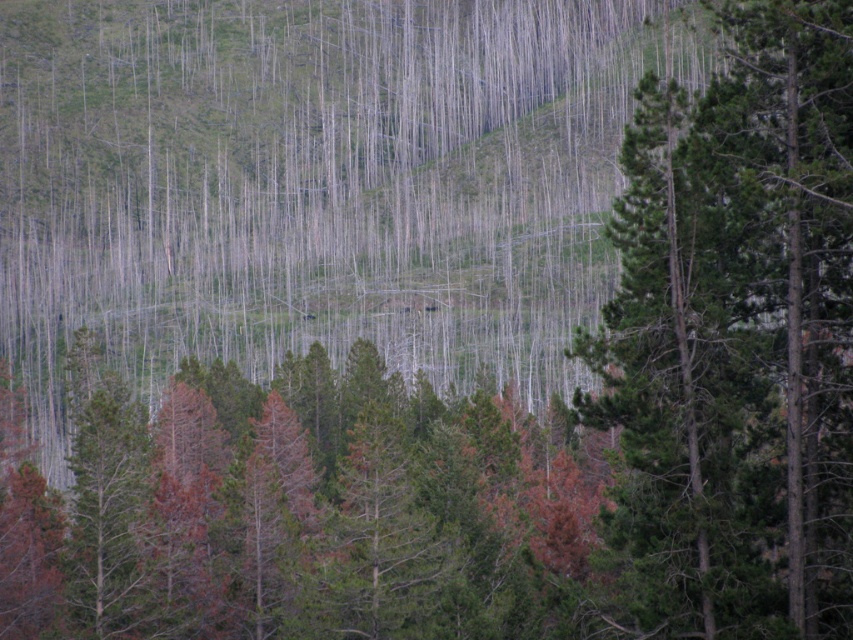
Is green matte tree at center in front of green textured tree at center?

That is False.

Between green matte tree at center and green textured tree at center, which one appears on the right side from the viewer's perspective?

green textured tree at center is more to the right.

At what (x,y) coordinates should I click in order to perform the action: click on green matte tree at center. Please return your answer as a coordinate pair (x, y). Looking at the image, I should click on (296, 509).